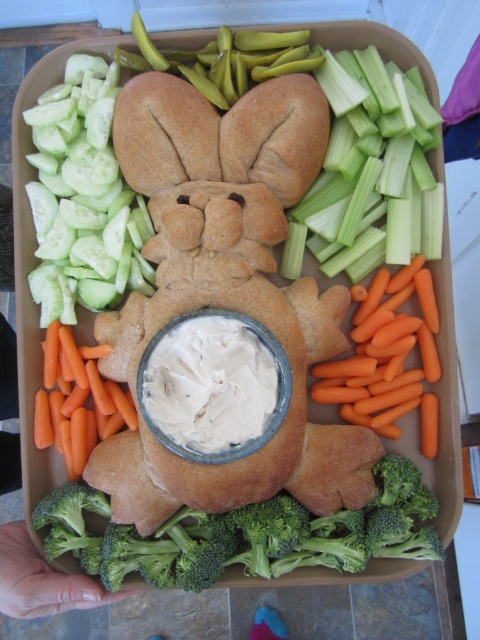
You are a food stylist arranging a bunny themed tray. You have the green broccoli at bottom and the orange smooth carrot at lower right. Which vegetable should you place first if you want to ensure the smaller one is positioned closer to the center of the tray?

The orange smooth carrot at lower right is smaller, so you should place it closer to the center first to ensure proper positioning before arranging the larger green broccoli at bottom around it.

You are a chef preparing a special bunny shaped dish. You have a green celery at upper right and a white creamy dip at center. Which item is wider?

The green celery at upper right might be wider than the white creamy dip at center according to the description.